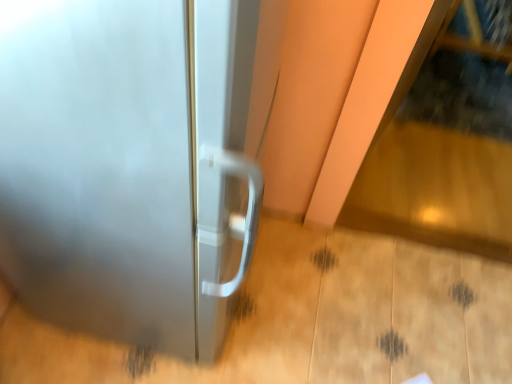
The height and width of the screenshot is (384, 512). Identify the location of vacant region to the right of satin silver door at center. (309, 302).